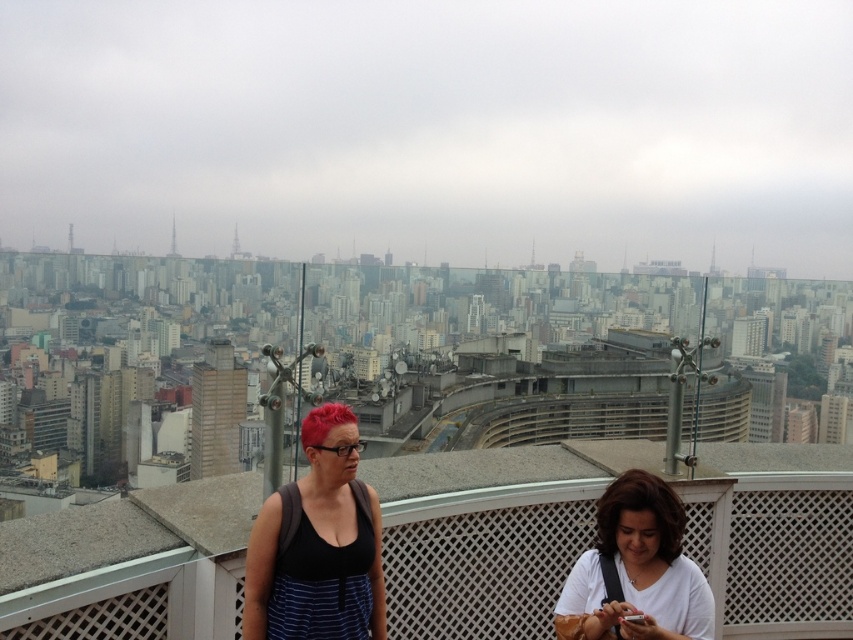
Consider the image. You are standing on the observation deck and want to take a photo of the cityscape. You notice the white lattice balcony at center and the white matte shirt at lower right. Which object should you avoid blocking to ensure the city view remains unobstructed?

To keep the city view unobstructed, avoid blocking the white lattice balcony at center because it is positioned to the left of the white matte shirt at lower right, meaning it is closer to the edge of the observation deck and less likely to block the central city view. Wait, actually, according to the description, the balcony is to the left of the shirt. Since the shirt is at lower right, the balcony is to the left of it. So if you want to avoid blocking the city view, you should avoid the object that is in

You are standing on the white lattice balcony at center and want to hand a book to the person wearing the white matte shirt at lower right. Can you reach them without leaving the balcony?

The white lattice balcony at center is below the white matte shirt at lower right, so you can reach them by extending your arm upwards since the balcony is positioned lower than the person.